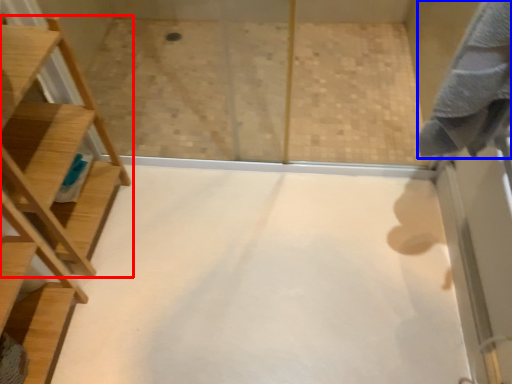
Question: Among these objects, which one is farthest to the camera, furniture (highlighted by a red box) or bath towel (highlighted by a blue box)?

Choices:
 (A) furniture
 (B) bath towel

Answer: (A)